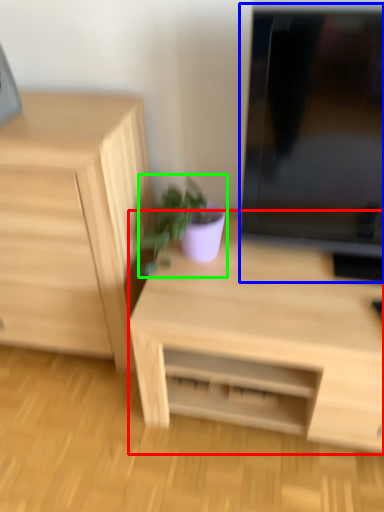
Question: Considering the real-world distances, which object is closest to desk (highlighted by a red box)? computer monitor (highlighted by a blue box) or houseplant (highlighted by a green box).

Choices:
 (A) computer monitor
 (B) houseplant

Answer: (B)